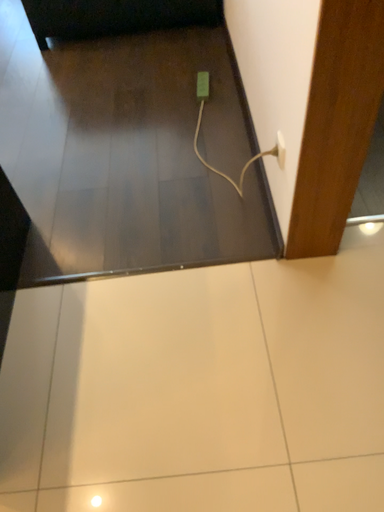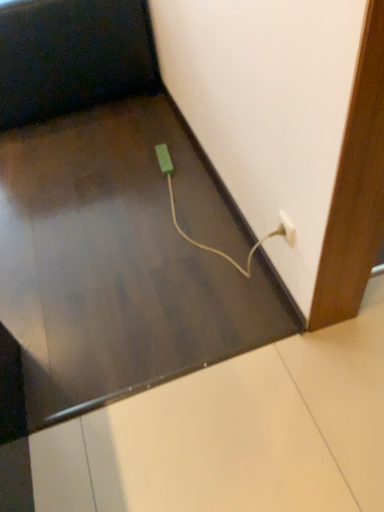
Question: How did the camera likely rotate when shooting the video?

Choices:
 (A) rotated right
 (B) rotated left

Answer: (A)